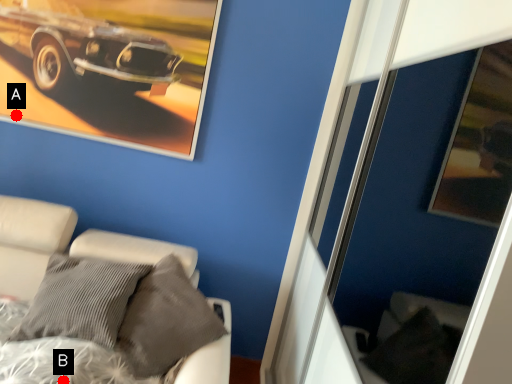
Question: Two points are circled on the image, labeled by A and B beside each circle. Among these points, which one is farthest from the camera?

Choices:
 (A) A is further
 (B) B is further

Answer: (A)